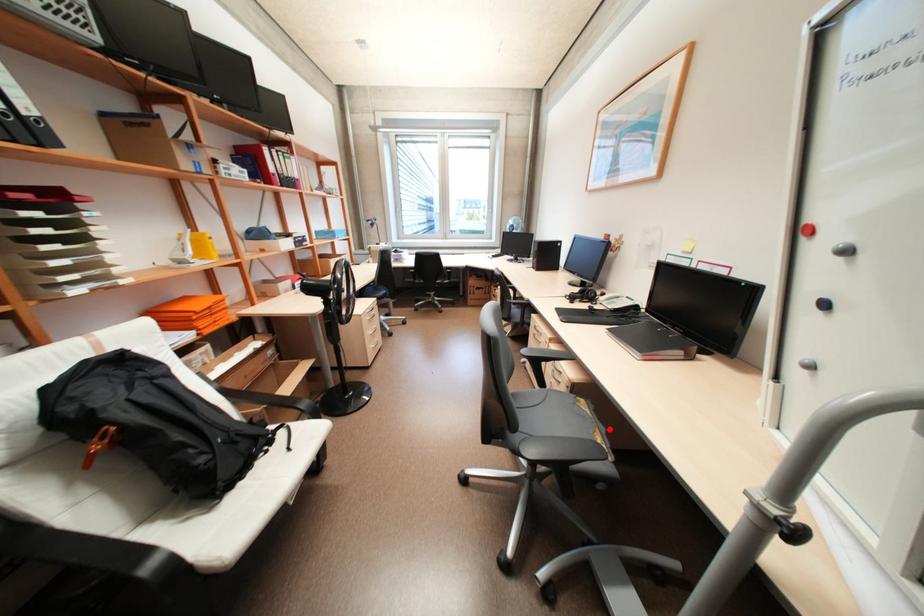
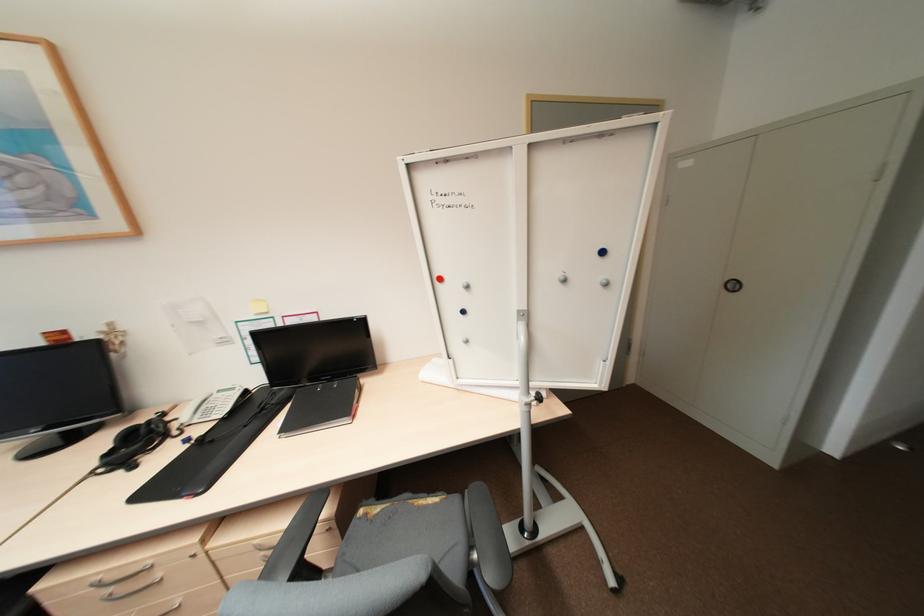
Where in the second image is the point corresponding to the highlighted location from the first image?

(415, 493)